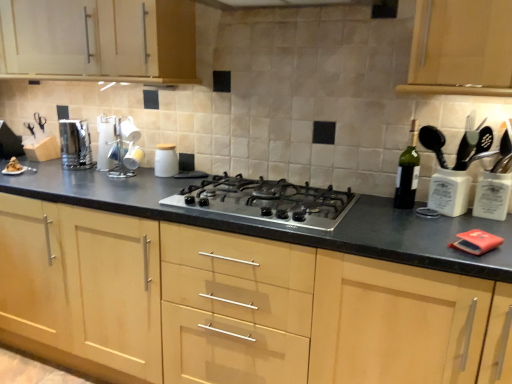
Image resolution: width=512 pixels, height=384 pixels. Describe the element at coordinates (408, 172) in the screenshot. I see `green glass bottle at right` at that location.

Where is `white ceramic jar at center, the first kitchen appliance from the right`? white ceramic jar at center, the first kitchen appliance from the right is located at coordinates (166, 160).

How many degrees apart are the facing directions of polished stainless steel toaster at left, positioned as the first kitchen appliance in left-to-right order, and white ceramic mugs at upper left?

The facing directions of polished stainless steel toaster at left, positioned as the first kitchen appliance in left-to-right order, and white ceramic mugs at upper left are 0.000224 degrees apart.

Is polished stainless steel toaster at left, positioned as the first kitchen appliance in left-to-right order, facing towards white ceramic mugs at upper left?

No, polished stainless steel toaster at left, positioned as the first kitchen appliance in left-to-right order, does not turn towards white ceramic mugs at upper left.

Between polished stainless steel toaster at left, positioned as the first kitchen appliance in left-to-right order, and white ceramic mugs at upper left, which one has smaller size?

white ceramic mugs at upper left.

Between polished stainless steel toaster at left, the 2th kitchen appliance when ordered from right to left, and white ceramic mugs at upper left, which one has more height?

Result: white ceramic mugs at upper left is taller.

Is green glass bottle at right wider than matte wood cabinet at upper left, which ranks as the 2th cabinetry in bottom-to-top order?

Incorrect, the width of green glass bottle at right does not surpass that of matte wood cabinet at upper left, which ranks as the 2th cabinetry in bottom-to-top order.

From a real-world perspective, which is physically below, green glass bottle at right or matte wood cabinet at upper left, which ranks as the 2th cabinetry in bottom-to-top order?

In real-world perspective, green glass bottle at right is lower.

Is green glass bottle at right inside or outside of matte wood cabinet at upper left, which ranks as the 2th cabinetry in bottom-to-top order?

green glass bottle at right is not enclosed by matte wood cabinet at upper left, which ranks as the 2th cabinetry in bottom-to-top order.

Which object is more forward, green glass bottle at right or matte wood cabinet at upper left, which ranks as the 2th cabinetry in bottom-to-top order?

green glass bottle at right is in front.

Is polished stainless steel toaster at left, the 2th kitchen appliance when ordered from right to left, closer to camera compared to green glass bottle at right?

No, polished stainless steel toaster at left, the 2th kitchen appliance when ordered from right to left, is further to the viewer.

Can you tell me how much polished stainless steel toaster at left, positioned as the first kitchen appliance in left-to-right order, and green glass bottle at right differ in facing direction?

There is a 3.25-degree angle between the facing directions of polished stainless steel toaster at left, positioned as the first kitchen appliance in left-to-right order, and green glass bottle at right.

Who is shorter, polished stainless steel toaster at left, positioned as the first kitchen appliance in left-to-right order, or green glass bottle at right?

Standing shorter between the two is polished stainless steel toaster at left, positioned as the first kitchen appliance in left-to-right order.

How far apart are polished stainless steel toaster at left, the 2th kitchen appliance when ordered from right to left, and green glass bottle at right?

They are 5.22 feet apart.

Can you tell me how much polished stainless steel toaster at left, the 2th kitchen appliance when ordered from right to left, and matte wood cabinet at upper left, which ranks as the 2th cabinetry in bottom-to-top order, differ in facing direction?

The angle between the facing direction of polished stainless steel toaster at left, the 2th kitchen appliance when ordered from right to left, and the facing direction of matte wood cabinet at upper left, which ranks as the 2th cabinetry in bottom-to-top order, is 3.99 degrees.

How much distance is there between polished stainless steel toaster at left, the 2th kitchen appliance when ordered from right to left, and matte wood cabinet at upper left, which ranks as the 2th cabinetry in bottom-to-top order?

polished stainless steel toaster at left, the 2th kitchen appliance when ordered from right to left, is 20.27 inches from matte wood cabinet at upper left, which ranks as the 2th cabinetry in bottom-to-top order.

Locate an element on the screen. Image resolution: width=512 pixels, height=384 pixels. kitchen appliance that is the 1st object located below the matte wood cabinet at upper left, which appears as the 1th cabinetry when viewed from the top (from the image's perspective) is located at coordinates (75, 145).

From a real-world perspective, who is located higher, polished stainless steel toaster at left, positioned as the first kitchen appliance in left-to-right order, or matte wood cabinet at upper left, which ranks as the 2th cabinetry in bottom-to-top order?

matte wood cabinet at upper left, which ranks as the 2th cabinetry in bottom-to-top order.

From a real-world perspective, is matte wood cabinet at upper left, which ranks as the 2th cabinetry in bottom-to-top order, physically above light wood cabinet at center, marked as the first cabinetry in a bottom-to-top arrangement?

Yes, from a real-world perspective, matte wood cabinet at upper left, which ranks as the 2th cabinetry in bottom-to-top order, is over light wood cabinet at center, marked as the first cabinetry in a bottom-to-top arrangement

Is matte wood cabinet at upper left, which appears as the 1th cabinetry when viewed from the top, at the left side of light wood cabinet at center, marked as the first cabinetry in a bottom-to-top arrangement?

Indeed, matte wood cabinet at upper left, which appears as the 1th cabinetry when viewed from the top, is positioned on the left side of light wood cabinet at center, marked as the first cabinetry in a bottom-to-top arrangement.

You are a GUI agent. You are given a task and a screenshot of the screen. Output one action in this format:
    pyautogui.click(x=<x>, y=<y>)
    Task: Click on the cabinetry located on the right of matte wood cabinet at upper left, which ranks as the 2th cabinetry in bottom-to-top order
    This screenshot has height=384, width=512.
    Given the screenshot: What is the action you would take?
    pyautogui.click(x=232, y=303)

From the image's perspective, between matte wood cabinet at upper left, which ranks as the 2th cabinetry in bottom-to-top order, and light wood cabinet at center, which is the 2th cabinetry in top-to-bottom order, who is located below?

light wood cabinet at center, which is the 2th cabinetry in top-to-bottom order, from the image's perspective.

Is matte wood cabinet at upper left, which appears as the 1th cabinetry when viewed from the top, completely or partially outside of white ceramic mugs at upper left?

matte wood cabinet at upper left, which appears as the 1th cabinetry when viewed from the top, is positioned outside white ceramic mugs at upper left.

Identify the location of cabinetry located above the white ceramic mugs at upper left (from the image's perspective). (99, 40).

Is satin silver gas stove at center thinner than white ceramic jar at center, the first kitchen appliance from the right?

No.

Which point is more distant from viewer, (347,194) or (173,162)?

Positioned behind is point (173,162).

In the image, is satin silver gas stove at center on the left side or the right side of white ceramic jar at center, the first kitchen appliance from the right?

Clearly, satin silver gas stove at center is on the right of white ceramic jar at center, the first kitchen appliance from the right, in the image.

Between satin silver gas stove at center and white ceramic jar at center, the second kitchen appliance from the left, which one has larger size?

With larger size is satin silver gas stove at center.

The width and height of the screenshot is (512, 384). What are the coordinates of `the 1st kitchen appliance located beneath the white ceramic mugs at upper left (from a real-world perspective)` in the screenshot? It's located at (75, 145).

The width and height of the screenshot is (512, 384). In order to click on bottle to the right of matte wood cabinet at upper left, which ranks as the 2th cabinetry in bottom-to-top order in this screenshot , I will do `click(408, 172)`.

Estimate the real-world distances between objects in this image. Which object is further from white ceramic jar at center, the first kitchen appliance from the right, green glass bottle at right or matte wood cabinet at upper left, which appears as the 1th cabinetry when viewed from the top?

Based on the image, green glass bottle at right appears to be further to white ceramic jar at center, the first kitchen appliance from the right.

When comparing their distances from white ceramic jar at center, the second kitchen appliance from the left, does matte wood cabinet at upper left, which appears as the 1th cabinetry when viewed from the top, or green glass bottle at right seem closer?

Based on the image, matte wood cabinet at upper left, which appears as the 1th cabinetry when viewed from the top, appears to be nearer to white ceramic jar at center, the second kitchen appliance from the left.

From the image, which object appears to be nearer to polished stainless steel toaster at left, positioned as the first kitchen appliance in left-to-right order, satin silver gas stove at center or light wood cabinet at center, marked as the first cabinetry in a bottom-to-top arrangement?

light wood cabinet at center, marked as the first cabinetry in a bottom-to-top arrangement.

From the image, which object appears to be farther from green glass bottle at right, polished stainless steel toaster at left, positioned as the first kitchen appliance in left-to-right order, or white ceramic mugs at upper left?

polished stainless steel toaster at left, positioned as the first kitchen appliance in left-to-right order, lies further to green glass bottle at right than the other object.

Considering their positions, is polished stainless steel toaster at left, positioned as the first kitchen appliance in left-to-right order, positioned closer to satin silver gas stove at center than light wood cabinet at center, which is the 2th cabinetry in top-to-bottom order?

light wood cabinet at center, which is the 2th cabinetry in top-to-bottom order, lies closer to satin silver gas stove at center than the other object.

From the picture: Which object lies further to the anchor point satin silver gas stove at center, polished stainless steel toaster at left, positioned as the first kitchen appliance in left-to-right order, or white ceramic mugs at upper left?

Based on the image, polished stainless steel toaster at left, positioned as the first kitchen appliance in left-to-right order, appears to be further to satin silver gas stove at center.

When comparing their distances from satin silver gas stove at center, does white ceramic mugs at upper left or green glass bottle at right seem further?

Among the two, white ceramic mugs at upper left is located further to satin silver gas stove at center.

Based on their spatial positions, is white ceramic mugs at upper left or white ceramic jar at center, the second kitchen appliance from the left, closer to matte wood cabinet at upper left, which ranks as the 2th cabinetry in bottom-to-top order?

Based on the image, white ceramic mugs at upper left appears to be nearer to matte wood cabinet at upper left, which ranks as the 2th cabinetry in bottom-to-top order.

This screenshot has height=384, width=512. I want to click on appliance between polished stainless steel toaster at left, the 2th kitchen appliance when ordered from right to left, and green glass bottle at right from left to right, so click(123, 148).

At what (x,y) coordinates should I click in order to perform the action: click on appliance situated between polished stainless steel toaster at left, positioned as the first kitchen appliance in left-to-right order, and white ceramic jar at center, the second kitchen appliance from the left, from left to right. Please return your answer as a coordinate pair (x, y). Looking at the image, I should click on (123, 148).

Identify the location of gas stove between light wood cabinet at center, which is the 2th cabinetry in top-to-bottom order, and green glass bottle at right. The width and height of the screenshot is (512, 384). (267, 201).

The width and height of the screenshot is (512, 384). Find the location of `gas stove located between light wood cabinet at center, which is the 2th cabinetry in top-to-bottom order, and white ceramic mugs at upper left in the depth direction`. gas stove located between light wood cabinet at center, which is the 2th cabinetry in top-to-bottom order, and white ceramic mugs at upper left in the depth direction is located at coordinates (267, 201).